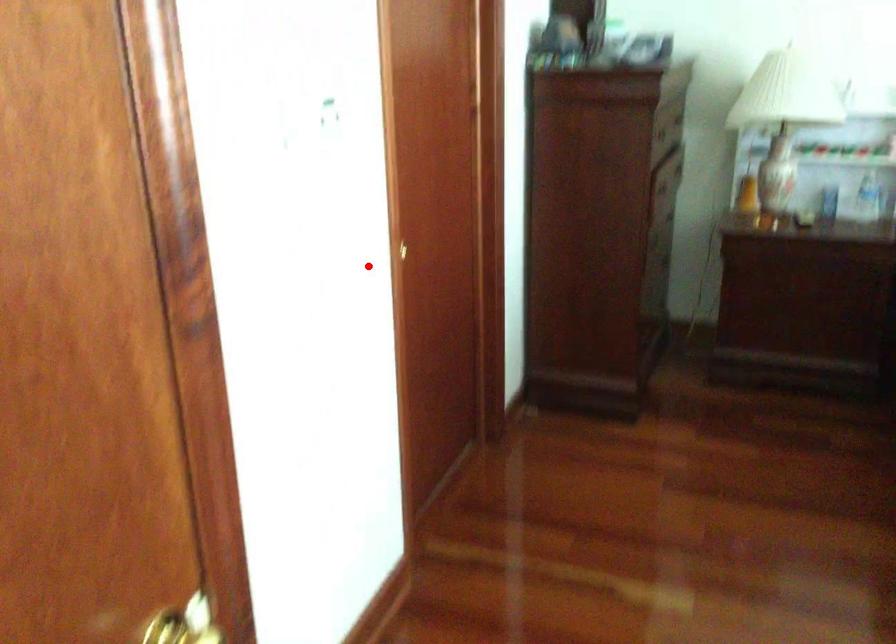
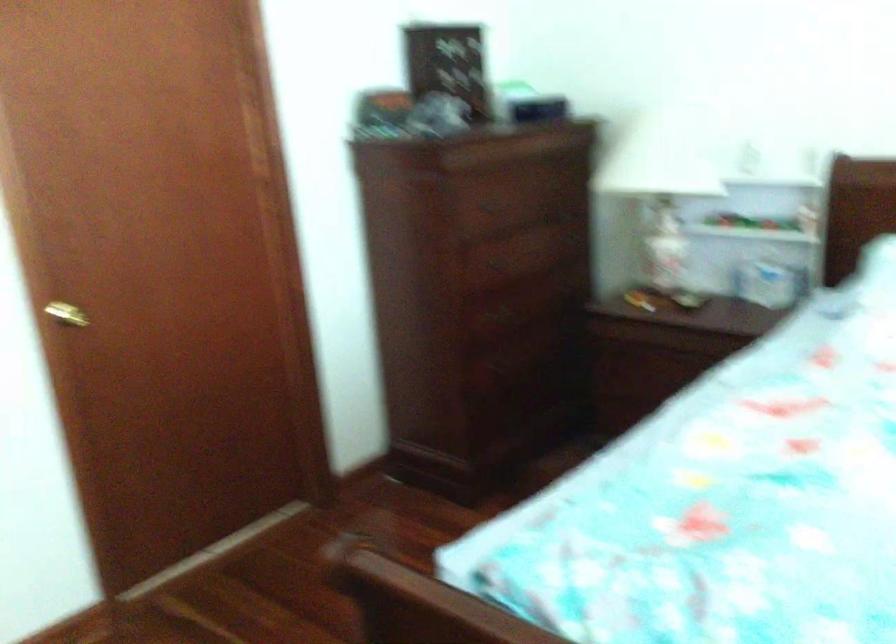
Question: I am providing you with two images of the same scene from different viewpoints. Image1 has a red point marked. In image2, the corresponding 3D location appears at what relative position? Reply with the corresponding letter.

Choices:
 (A) Closer
 (B) Farther

Answer: (B)